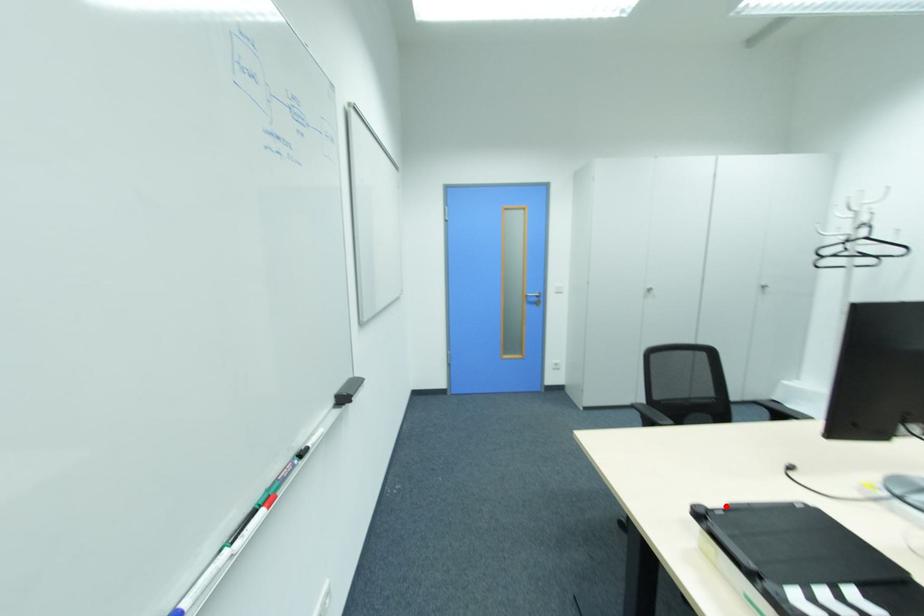
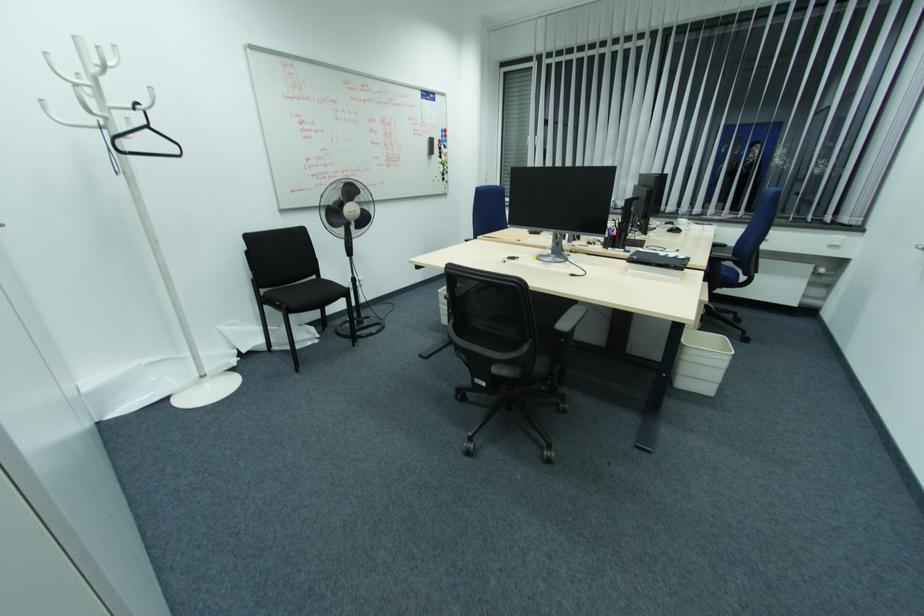
The point at the highlighted location is marked in the first image. Where is the corresponding point in the second image?

(669, 265)